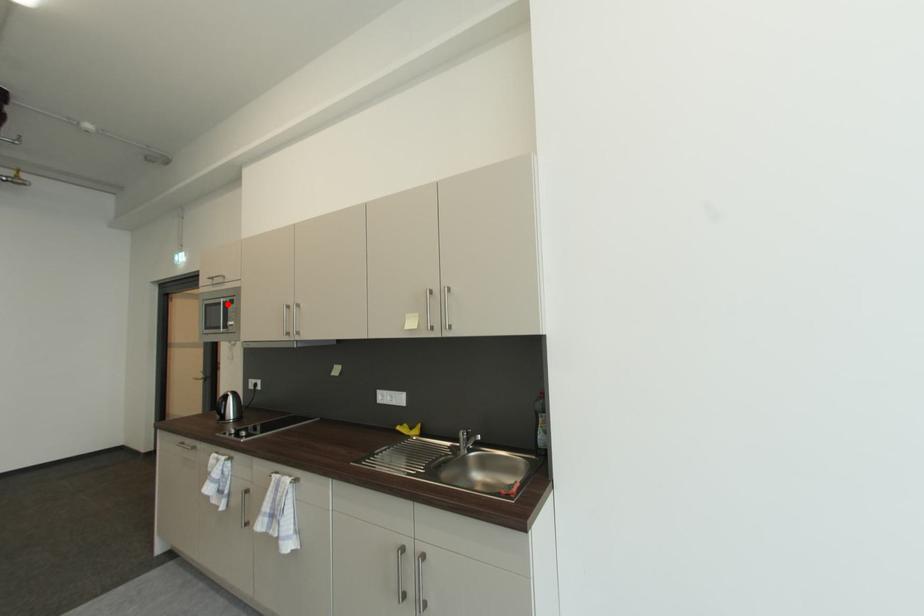
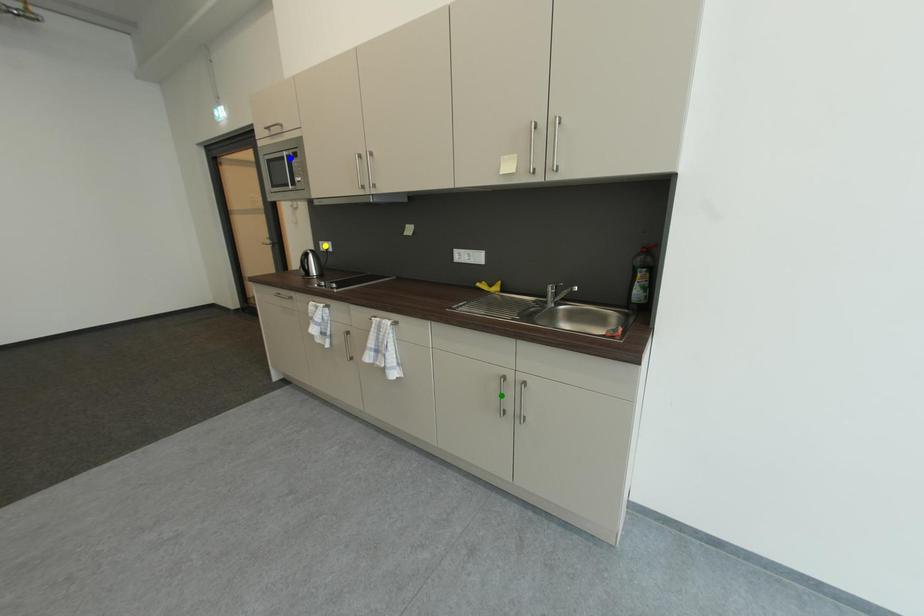
Question: I am providing you with two images of the same scene from different viewpoints. A red point is marked on the first image. You are given multiple points on the second image. Which spot in image 2 lines up with the point in image 1?

Choices:
 (A) blue point
 (B) green point
 (C) yellow point

Answer: (A)